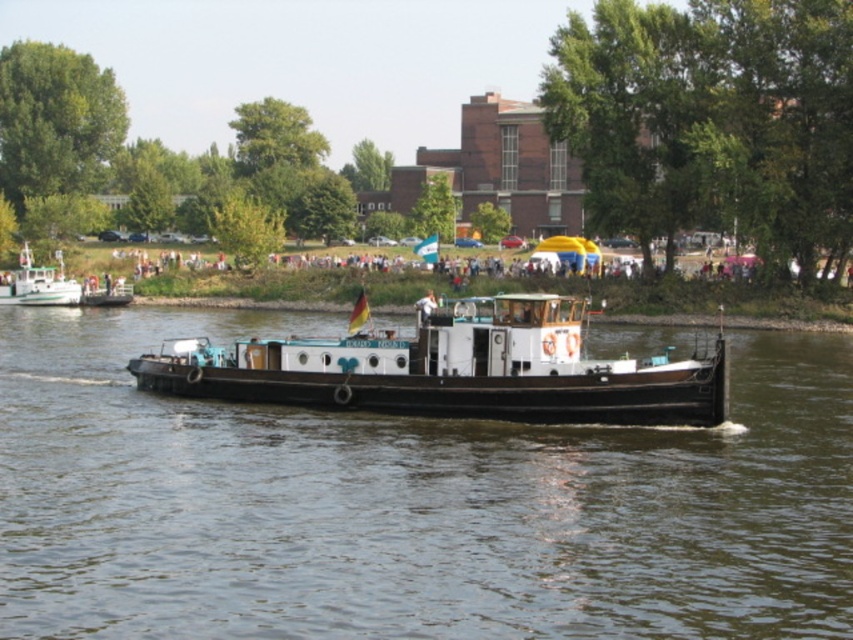
Question: Which of the following is the farthest from the observer?

Choices:
 (A) black matte barge at center
 (B) wooden boat at center

Answer: (B)

Question: Observing the image, what is the correct spatial positioning of wooden boat at center in reference to green matte boat at left?

Choices:
 (A) above
 (B) below

Answer: (B)

Question: Which of the following is the farthest from the observer?

Choices:
 (A) wooden boat at center
 (B) green matte boat at left

Answer: (B)

Question: Does black matte barge at center appear under green matte boat at left?

Choices:
 (A) yes
 (B) no

Answer: (A)

Question: Is black matte barge at center below wooden boat at center?

Choices:
 (A) no
 (B) yes

Answer: (B)

Question: Which object is farther from the camera taking this photo?

Choices:
 (A) wooden boat at center
 (B) green matte boat at left
 (C) black matte barge at center

Answer: (B)